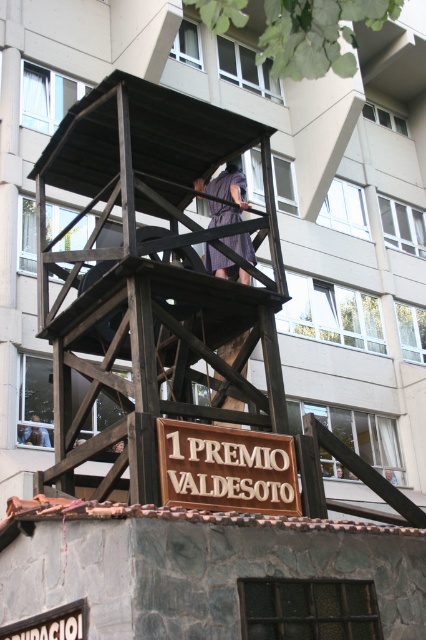
Question: Can you confirm if wooden scaffolding at center is positioned above dark purple dress at center?

Choices:
 (A) no
 (B) yes

Answer: (A)

Question: Which point is closer to the camera?

Choices:
 (A) dark purple dress at center
 (B) wooden scaffolding at center

Answer: (B)

Question: Can you confirm if wooden scaffolding at center is bigger than light brown wooden man at upper center?

Choices:
 (A) no
 (B) yes

Answer: (B)

Question: Which point is closer to the camera?

Choices:
 (A) dark purple dress at center
 (B) brown wooden sign at center

Answer: (B)

Question: Which point is farther to the camera?

Choices:
 (A) (244, 253)
 (B) (40, 435)
 (C) (51, 243)

Answer: (B)

Question: Is wooden scaffolding at center wider than dark purple dress at center?

Choices:
 (A) no
 (B) yes

Answer: (B)